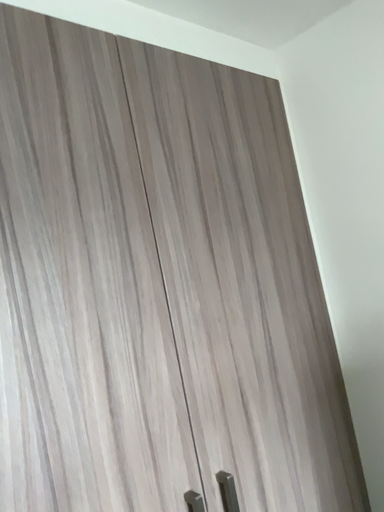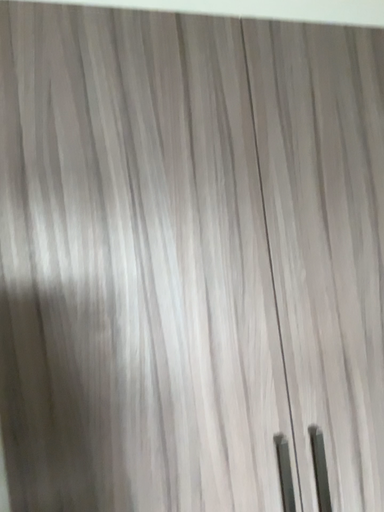
Question: Which way did the camera rotate in the video?

Choices:
 (A) rotated right
 (B) rotated left

Answer: (B)